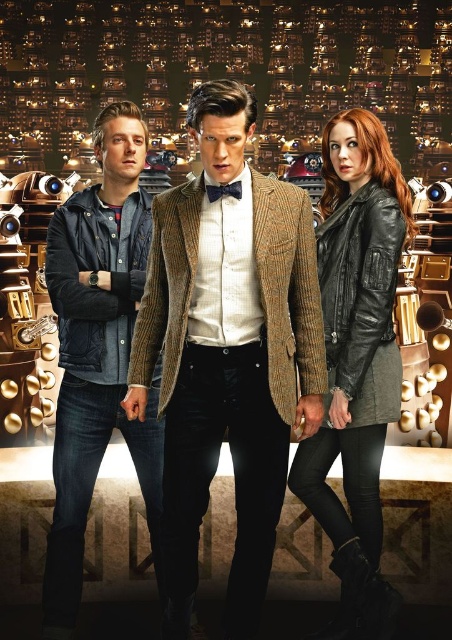
In the scene shown: You are a photographer positioned in front of the three people. You want to take a photo that focuses on the brown woolen blazer at center and the black leather jacket at right. Which of the two is positioned closer to you?

The brown woolen blazer at center is closer to the viewer than the black leather jacket at right, so the brown woolen blazer at center would be the one closer to you.

Based on the scene description, if you were to walk from the denim jacket at left towards the brown woolen blazer at center, in which direction would you move?

You would move to the right because the brown woolen blazer at center is positioned to the right of the denim jacket at left.